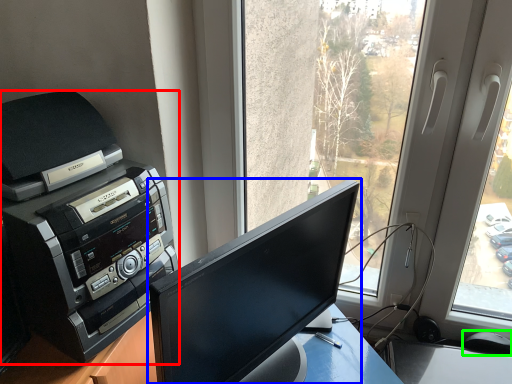
Question: Which object is the closest to the printer (highlighted by a red box)? Choose among these: computer monitor (highlighted by a blue box) or mouse (highlighted by a green box).

Choices:
 (A) computer monitor
 (B) mouse

Answer: (A)